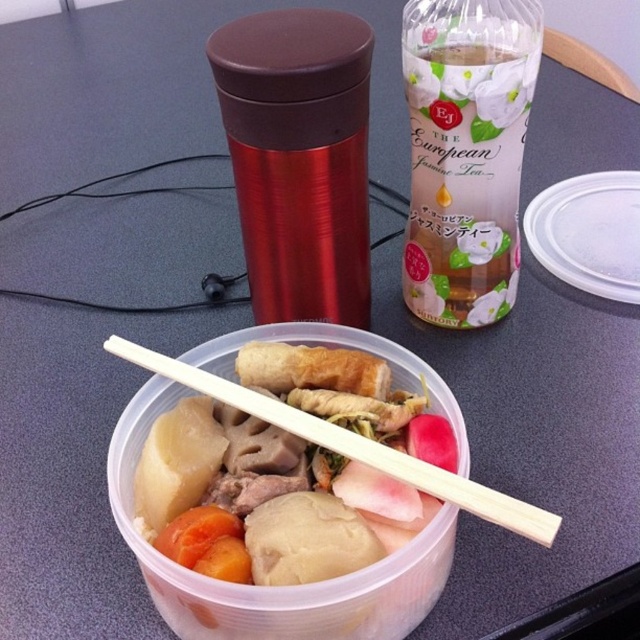
Question: Is metallic red thermos at upper center to the left of wooden chopsticks at center from the viewer's perspective?

Choices:
 (A) yes
 (B) no

Answer: (A)

Question: Is the position of white paper bottle at upper center less distant than that of wooden chopsticks at center?

Choices:
 (A) no
 (B) yes

Answer: (A)

Question: Which point appears farthest from the camera in this image?

Choices:
 (A) (468, 504)
 (B) (284, 250)

Answer: (B)

Question: Which is farther from the wooden chopsticks at center?

Choices:
 (A) white paper bottle at upper center
 (B) metallic red thermos at upper center

Answer: (A)

Question: Estimate the real-world distances between objects in this image. Which object is closer to the metallic red thermos at upper center?

Choices:
 (A) wooden chopsticks at center
 (B) white paper bottle at upper center

Answer: (B)

Question: Is metallic red thermos at upper center positioned at the back of wooden chopsticks at center?

Choices:
 (A) yes
 (B) no

Answer: (A)